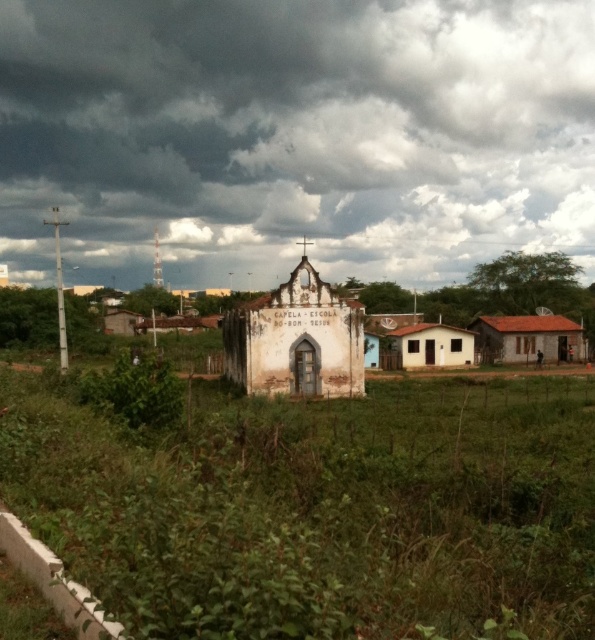
Does point (295, 74) come behind point (278, 346)?

Yes, point (295, 74) is farther from viewer.

Is dark gray cloud at upper center positioned behind white weathered chapel at center?

Yes, it is behind white weathered chapel at center.

Is point (212, 97) closer to camera compared to point (353, 371)?

No, it is behind (353, 371).

In order to click on dark gray cloud at upper center in this screenshot , I will do `click(295, 136)`.

Which is in front, point (173, 241) or point (129, 380)?

Point (129, 380) is in front.

Is point (455, 141) less distant than point (177, 387)?

No, (455, 141) is behind (177, 387).

Which is behind, point (86, 28) or point (131, 371)?

The point (86, 28) is more distant.

What are the coordinates of `dark gray cloud at upper center` in the screenshot? It's located at (295, 136).

Does white weathered chapel at center come behind green leafy plant at lower left?

Yes, white weathered chapel at center is further from the viewer.

Who is positioned more to the right, white weathered chapel at center or green leafy plant at lower left?

white weathered chapel at center

Locate an element on the screen. The height and width of the screenshot is (640, 595). white weathered chapel at center is located at coordinates (295, 339).

Where is `white weathered chapel at center`? white weathered chapel at center is located at coordinates (295, 339).